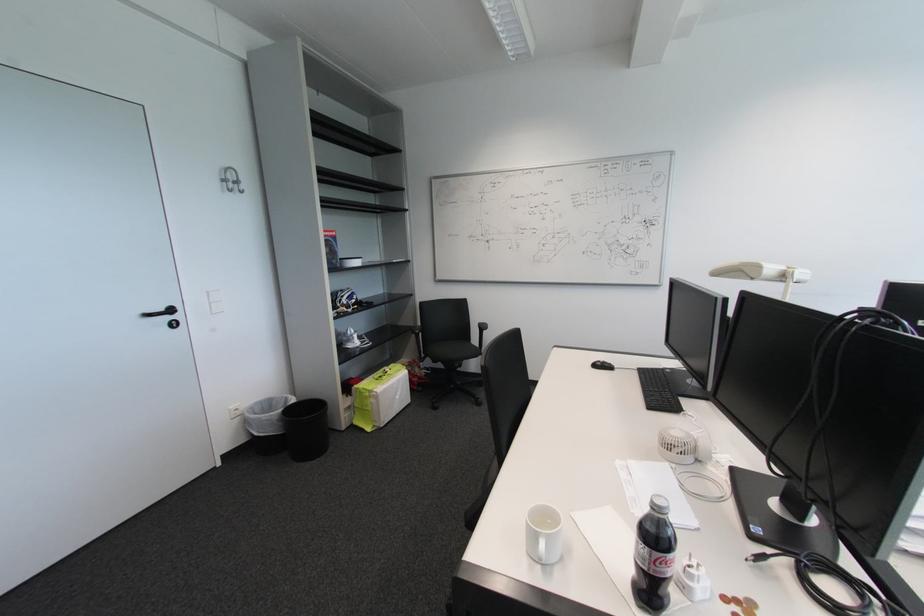
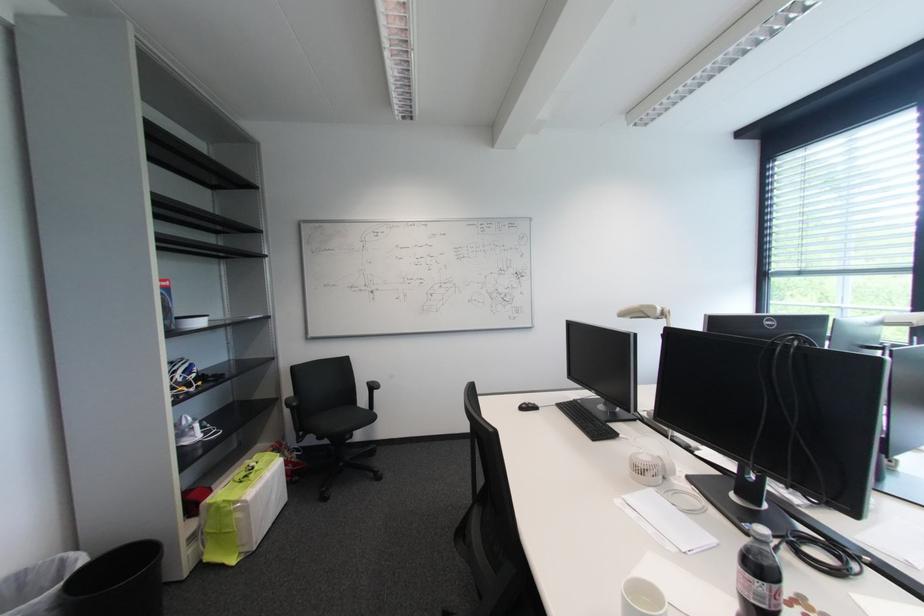
The point at (481, 341) is marked in the first image. Where is the corresponding point in the second image?

(369, 403)